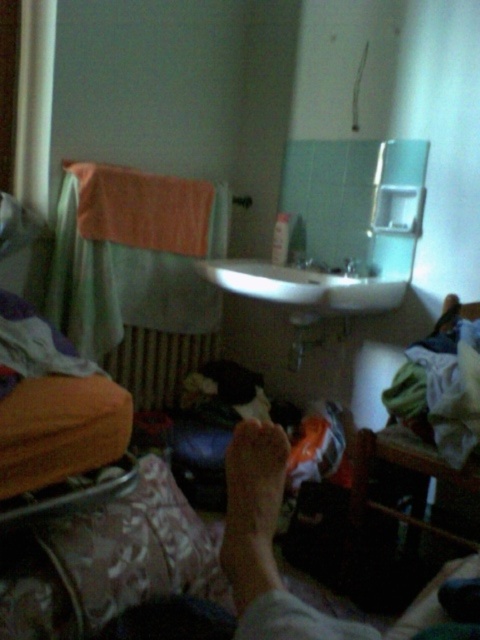
Question: In this image, where is light skin tone foot at center located relative to white glossy sink at center?

Choices:
 (A) below
 (B) above

Answer: (A)

Question: Can you confirm if orange towel at left is positioned to the right of light skin tone foot at center?

Choices:
 (A) no
 (B) yes

Answer: (A)

Question: Which object is positioned closest to the orange towel at left?

Choices:
 (A) white glossy sink at center
 (B) white glossy faucet at center
 (C) white glossy faucet at upper center
 (D) matte metal radiator at center

Answer: (D)

Question: Which object appears farthest from the camera in this image?

Choices:
 (A) orange towel at left
 (B) light skin tone foot at center
 (C) white glossy sink at center

Answer: (A)

Question: Is light skin tone foot at center above matte metal radiator at center?

Choices:
 (A) yes
 (B) no

Answer: (B)

Question: Which object is the closest to the white glossy faucet at center?

Choices:
 (A) white glossy sink at center
 (B) white glossy faucet at upper center
 (C) light skin tone foot at center
 (D) matte metal radiator at center

Answer: (B)